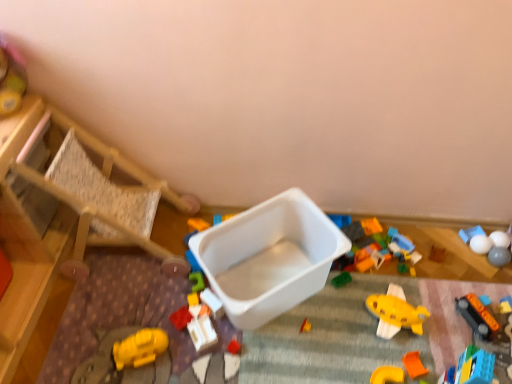
I want to click on free point behind orange matte plastic toy at lower right, the 10th toy viewed from the right, so click(x=368, y=332).